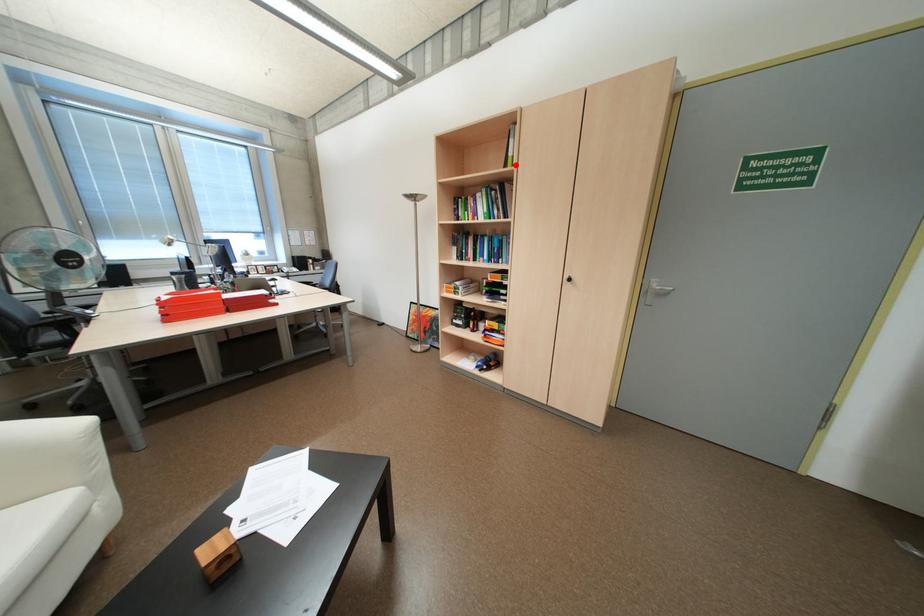
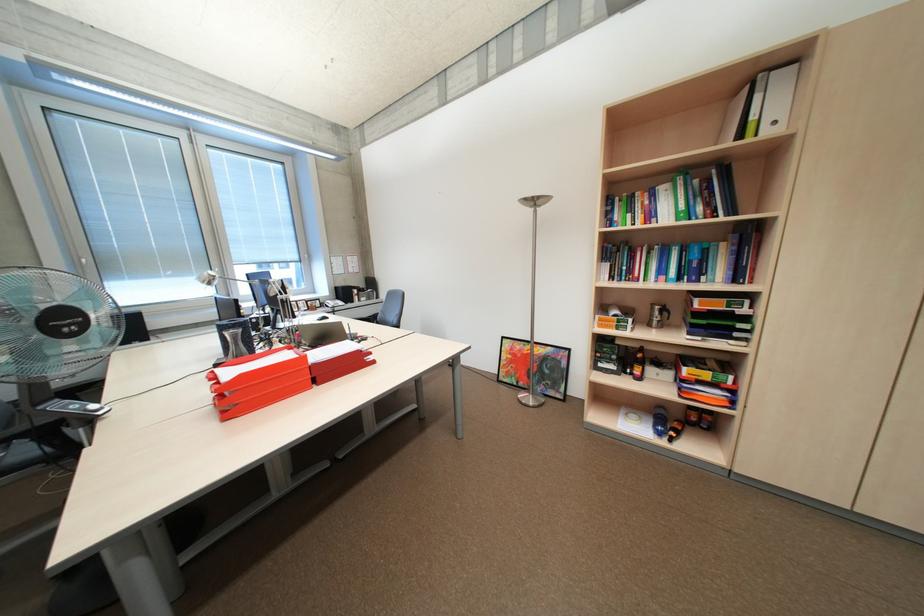
Question: I am providing you with two images of the same scene from different viewpoints. In image1, a red point is highlighted. Considering the same 3D point in image2, which of the following is correct?

Choices:
 (A) It is closer
 (B) It is farther

Answer: (B)